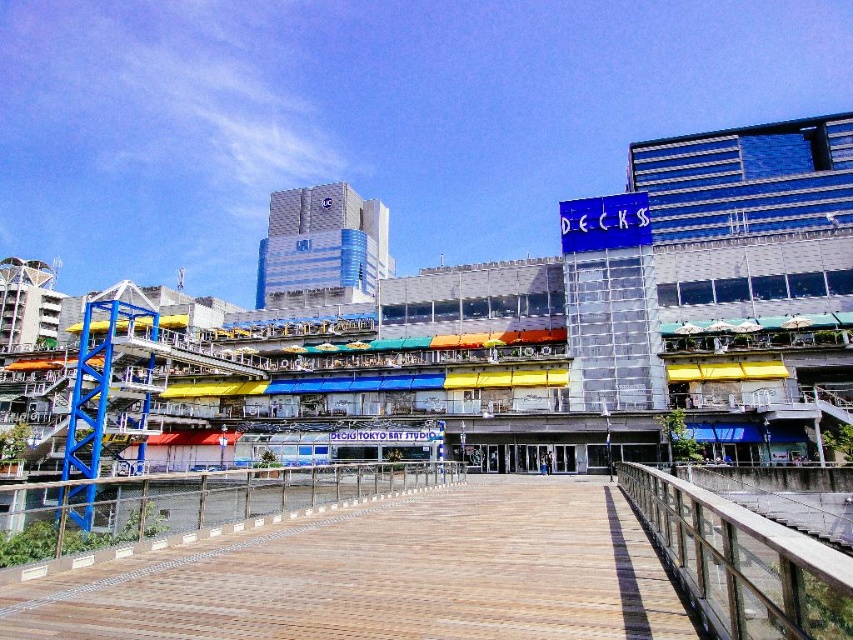
From the picture: You are standing on the boardwalk and want to walk from the point at coordinates point (x=670, y=460) to the point at coordinates point (x=39, y=488). Which direction should you face to move towards the second point?

→ Since point (x=670, y=460) is further to the viewer than point 0.764, 048, you should face away from the boardwalk towards the waterfront to move towards the second point.

You are standing on the boardwalk and want to walk towards the commercial complex. You see the wooden deck at center and the metallic silver railing at center. Which object is closer to the direction you are facing?

The wooden deck at center is positioned on the right side of the metallic silver railing at center. Since you are facing the commercial complex, the metallic silver railing at center would be closer to your left side, making the wooden deck at center the one closer to your right side. However, both are along the boardwalk leading towards the complex, so their distance from you depends on your current position. The question asks which is closer to the direction you are facing. Since the boardwalk leads to a